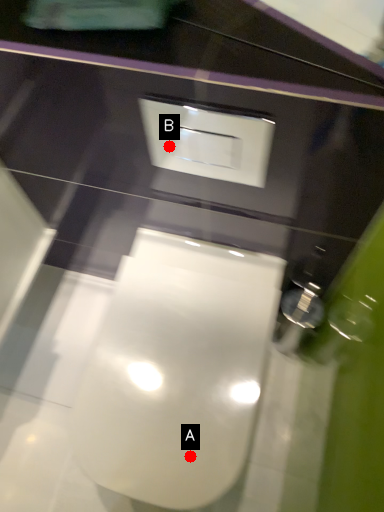
Question: Two points are circled on the image, labeled by A and B beside each circle. Which point appears closest to the camera in this image?

Choices:
 (A) A is closer
 (B) B is closer

Answer: (A)